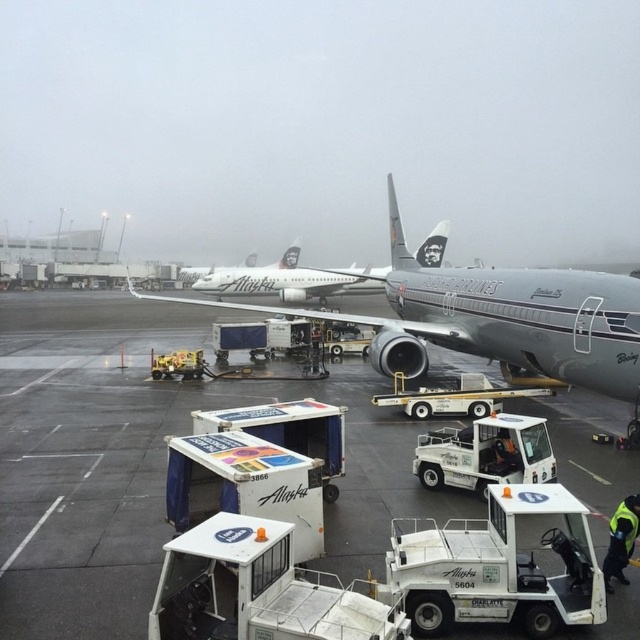
You are a pilot who just landed your plane and needs to taxi to the gate. There is a point marked at coordinates (150,460) on the tarmac. What is the condition of the tarmac at that point?

The point at coordinates (150,460) marks smooth gray tarmac at center, so the tarmac there is smooth and suitable for taxiing.

Looking at this image, you are an airport worker who needs to move a heavy cart from the terminal to the baggage carts. The path leads directly under the silver metallic airplane at center. Is the smooth gray tarmac at center wide enough to accommodate the cart?

The smooth gray tarmac at center is positioned under the silver metallic airplane at center, so the cart can move along the tarmac since it is under the airplane and likely provides sufficient space for the cart to pass.